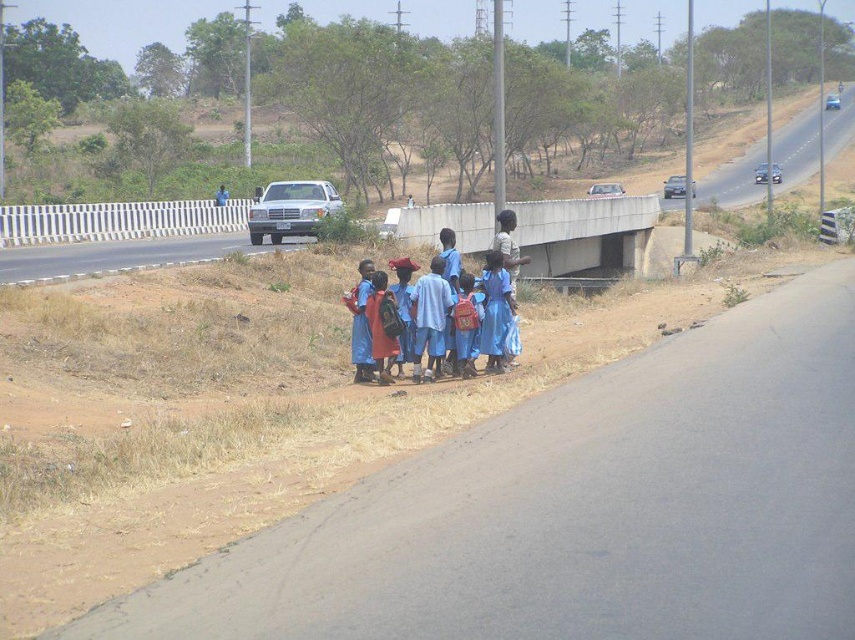
Looking at this image, you are a delivery drone operator. Your drone is currently at the point marked at point (396, 307). You need to deliver a package to a location that is 15.04 meters away from your current position. The scene shows children waiting near a bridge on a road. Can you safely land the drone at the destination point without endangering the children?

The point marked at point (396, 307) is 15.04 meters away from the destination. Since the children are standing on the side of the road near the bridge, you can safely land the drone at the destination point as long as it is not in the immediate vicinity of the children or the road with vehicles. However, ensure the landing area is clear of obstacles and away from the children to avoid any risks.

You are a pedestrian trying to cross the asphalt road at upper right. There is a blue fabric backpack at center in your path. Can you safely step over it?

The blue fabric backpack at center is behind asphalt road at upper right, meaning it is not on the road itself. Therefore, you can safely cross the asphalt road at upper right without needing to step over the backpack.